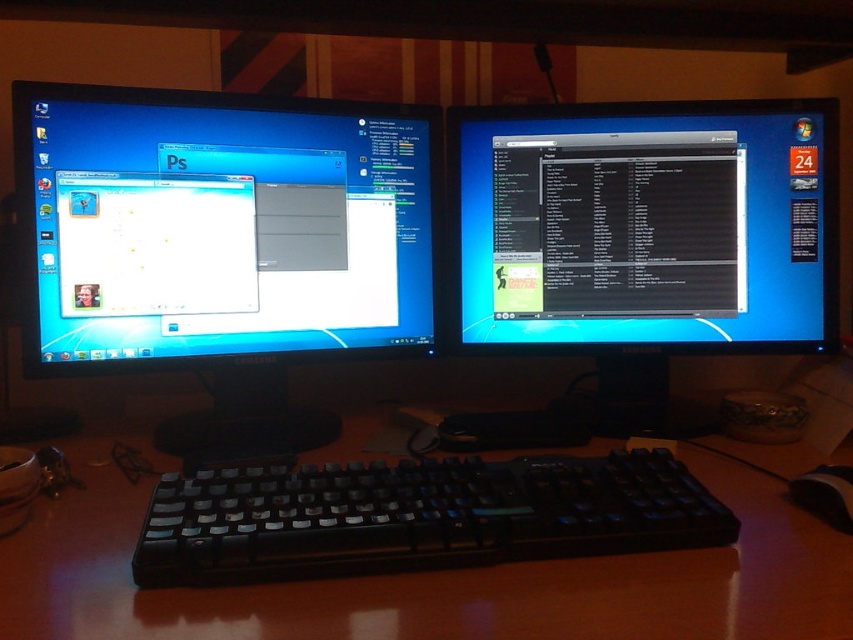
Question: Does black plastic computer desk at center have a smaller size compared to brown wooden computer desk at center?

Choices:
 (A) no
 (B) yes

Answer: (A)

Question: Which of the following is the closest to the observer?

Choices:
 (A) (341, 192)
 (B) (689, 132)
 (C) (244, 544)
 (D) (747, 538)

Answer: (C)

Question: Is black plastic keyboard at center above black matte text editor at center?

Choices:
 (A) no
 (B) yes

Answer: (A)

Question: Which of the following is the farthest from the observer?

Choices:
 (A) black plastic computer desk at center
 (B) black matte text editor at center
 (C) black plastic mouse at lower right
 (D) black plastic keyboard at center

Answer: (B)

Question: Does matte black monitor at left appear on the right side of black plastic mouse at lower right?

Choices:
 (A) no
 (B) yes

Answer: (A)

Question: Estimate the real-world distances between objects in this image. Which object is farther from the black plastic computer desk at center?

Choices:
 (A) black plastic keyboard at center
 (B) matte black monitor at left

Answer: (A)